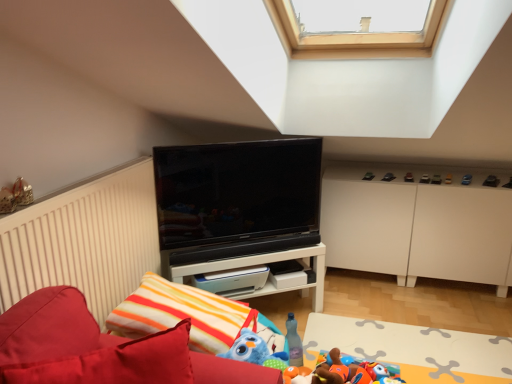
You are a GUI agent. You are given a task and a screenshot of the screen. Output one action in this format:
    pyautogui.click(x=<x>, y=<y>)
    Task: Click on the blank space to the left of blue plastic toy at upper right, the second toy viewed from the right
    This screenshot has width=512, height=384.
    Given the screenshot: What is the action you would take?
    pyautogui.click(x=448, y=179)